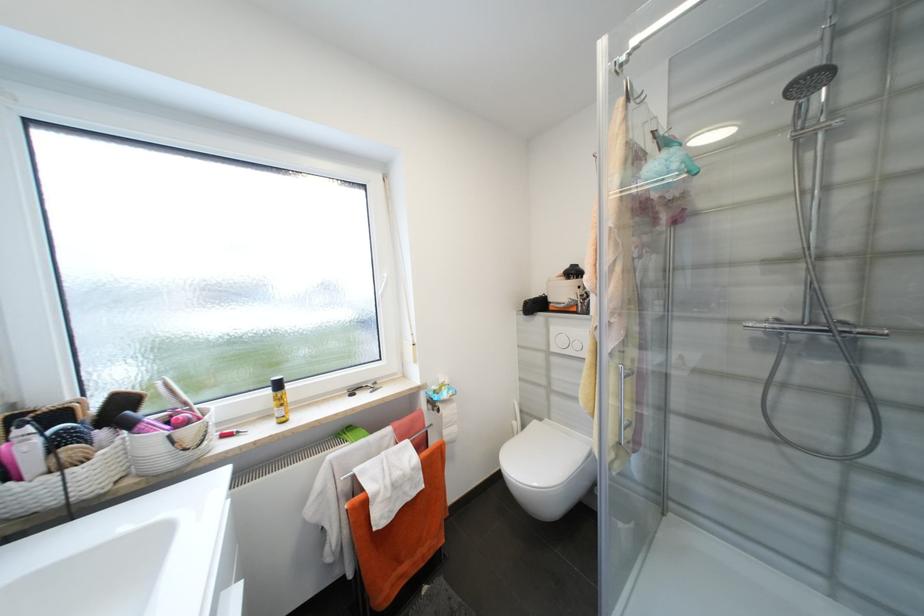
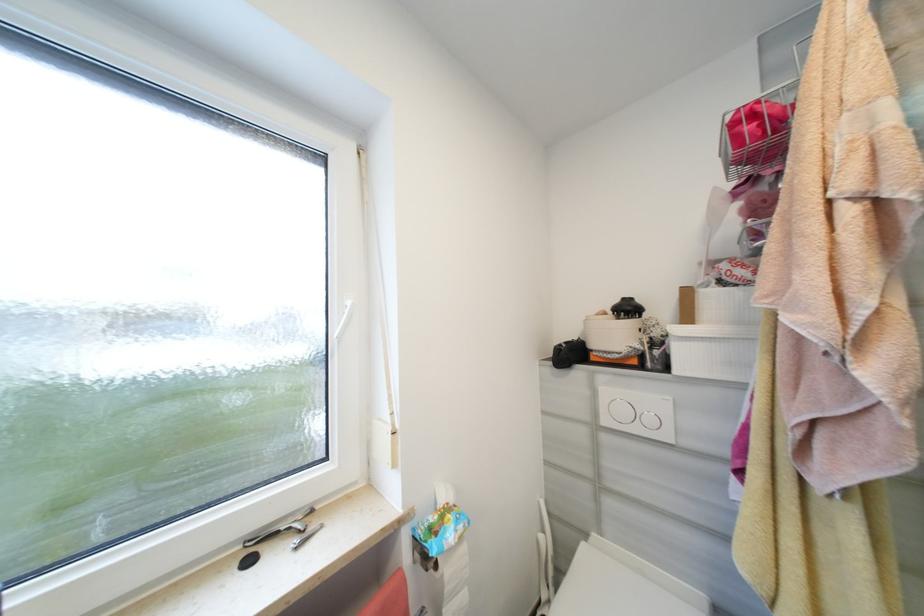
Question: The first image is from the beginning of the video and the second image is from the end. How did the camera likely rotate when shooting the video?

Choices:
 (A) Left
 (B) Right
 (C) Up
 (D) Down

Answer: (C)